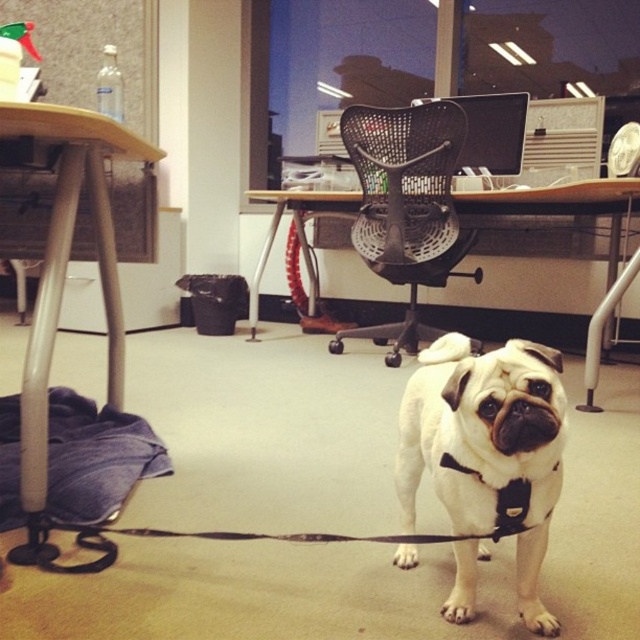
Question: Considering the real-world distances, which object is farthest from the wooden desk at left?

Choices:
 (A) black mesh chair at center
 (B) white fur dog at center

Answer: (A)

Question: Considering the real-world distances, which object is closest to the white fur dog at center?

Choices:
 (A) black mesh chair at center
 (B) wooden desk at left

Answer: (B)

Question: Does white fur dog at center have a greater width compared to black mesh chair at center?

Choices:
 (A) yes
 (B) no

Answer: (B)

Question: Does white fur dog at center have a lesser width compared to black mesh chair at center?

Choices:
 (A) yes
 (B) no

Answer: (A)

Question: Does white fur dog at center have a lesser width compared to black mesh chair at center?

Choices:
 (A) yes
 (B) no

Answer: (A)

Question: Which object appears farthest from the camera in this image?

Choices:
 (A) white fur dog at center
 (B) wooden desk at left

Answer: (B)